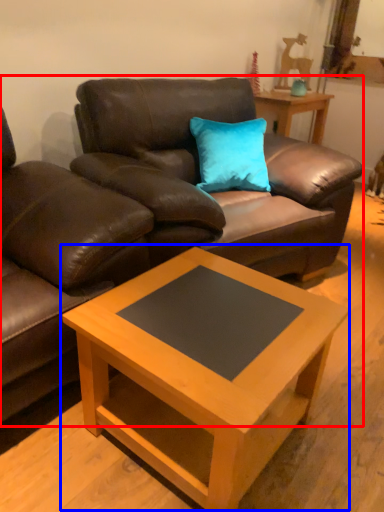
Question: Among these objects, which one is farthest to the camera, studio couch (highlighted by a red box) or coffee table (highlighted by a blue box)?

Choices:
 (A) studio couch
 (B) coffee table

Answer: (A)